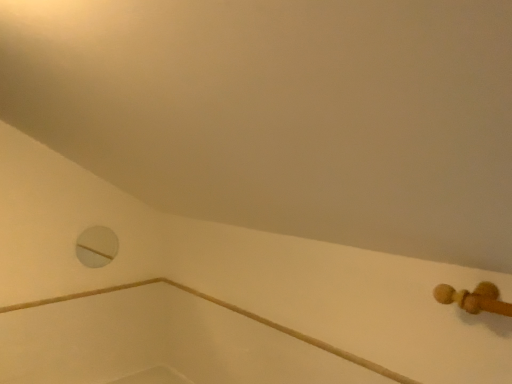
Question: In the image, is wooden rail at lower right on the left side or the right side of white matte hole at upper left?

Choices:
 (A) left
 (B) right

Answer: (B)

Question: From a real-world perspective, is wooden rail at lower right positioned above or below white matte hole at upper left?

Choices:
 (A) below
 (B) above

Answer: (A)

Question: Relative to white matte hole at upper left, is wooden rail at lower right in front or behind?

Choices:
 (A) front
 (B) behind

Answer: (A)

Question: Considering the positions of white matte hole at upper left and wooden rail at lower right in the image, is white matte hole at upper left bigger or smaller than wooden rail at lower right?

Choices:
 (A) big
 (B) small

Answer: (B)

Question: Does point (95, 236) appear closer or farther from the camera than point (268, 324)?

Choices:
 (A) farther
 (B) closer

Answer: (A)

Question: From the image's perspective, is white matte hole at upper left located above or below wooden rail at lower right?

Choices:
 (A) above
 (B) below

Answer: (A)

Question: Is white matte hole at upper left in front of or behind wooden rail at lower right in the image?

Choices:
 (A) behind
 (B) front

Answer: (A)